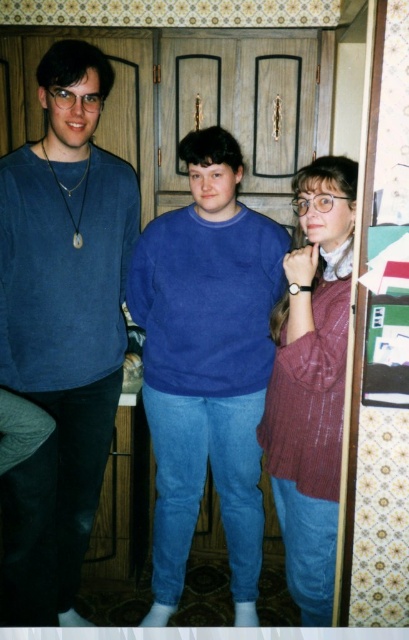
Question: Based on their relative distances, which object is farther from the knitted maroon sweater at center?

Choices:
 (A) blue cotton sweater at center
 (B) matte blue sweater at left

Answer: (B)

Question: Estimate the real-world distances between objects in this image. Which object is farther from the knitted maroon sweater at center?

Choices:
 (A) blue cotton sweater at center
 (B) matte blue sweater at left

Answer: (B)

Question: Does matte blue sweater at left appear under blue cotton sweater at center?

Choices:
 (A) no
 (B) yes

Answer: (A)

Question: Which point is farther to the camera?

Choices:
 (A) (327, 204)
 (B) (103, 440)
 (C) (200, 289)

Answer: (B)

Question: Does matte blue sweater at left appear over blue cotton sweater at center?

Choices:
 (A) yes
 (B) no

Answer: (A)

Question: Can you confirm if blue cotton sweater at center is positioned above knitted maroon sweater at center?

Choices:
 (A) yes
 (B) no

Answer: (B)